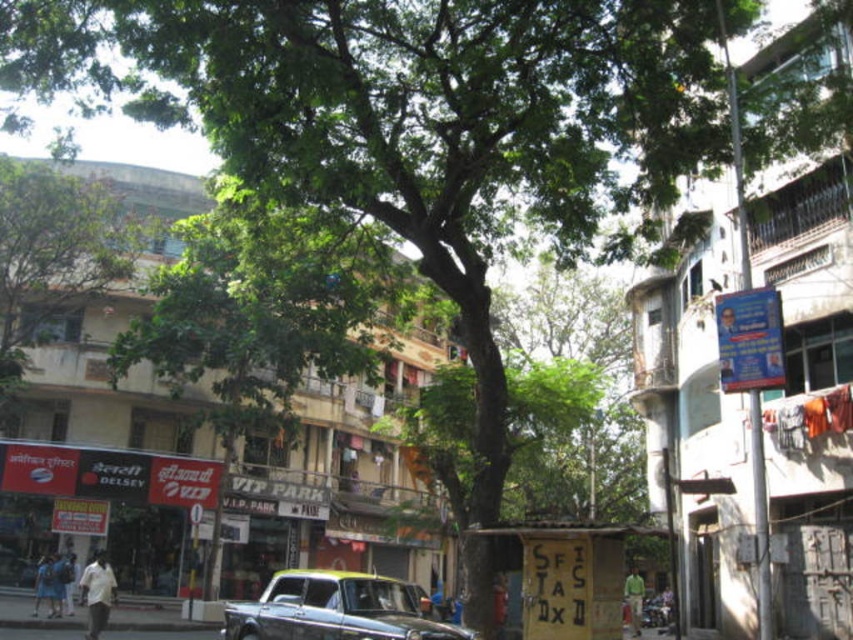
You are a drone operator tasked with capturing aerial footage of the green leafy tree at center. The drone has a maximum flight range of 40 meters. Based on the scene description, will the drone be able to capture the tree without exceeding its flight range?

The green leafy tree at center is 42.91 meters from camera, which exceeds the drone maximum flight range of 40 meters. The drone cannot capture the tree without exceeding its flight range.

You are a pedestrian standing on the street and want to walk from the green leafy tree at center to the metallic gray car at center. Which direction should you move in to reach the car?

The green leafy tree at center is to the left of the metallic gray car at center, so you should move to the right to reach the car.

You are standing at the point with coordinates (x=265, y=312) in the image. What object is located exactly at this point?

The green leafy tree at center is located exactly at point (x=265, y=312).